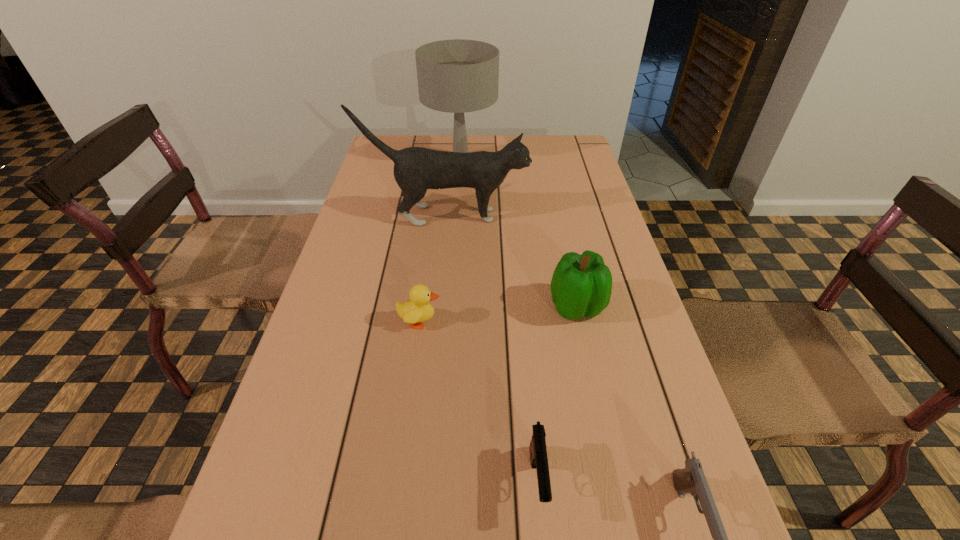
Locate an element on the screen. This screenshot has width=960, height=540. the farthest object is located at coordinates (457, 76).

Identify the location of the second farthest object. (416, 169).

The image size is (960, 540). In order to click on bell pepper in this screenshot , I will do `click(581, 285)`.

You are a GUI agent. You are given a task and a screenshot of the screen. Output one action in this format:
    pyautogui.click(x=<x>, y=<y>)
    Task: Click on the fourth shortest object
    The height and width of the screenshot is (540, 960).
    Given the screenshot: What is the action you would take?
    pyautogui.click(x=581, y=285)

The height and width of the screenshot is (540, 960). I want to click on duckling, so click(417, 309).

You are a GUI agent. You are given a task and a screenshot of the screen. Output one action in this format:
    pyautogui.click(x=<x>, y=<y>)
    Task: Click on the left pistol
    This screenshot has height=540, width=960.
    Given the screenshot: What is the action you would take?
    pyautogui.click(x=538, y=453)

Identify the location of free space located on the front-facing side of the farthest object. (537, 158).

Find the location of `vacant position located 0.230m at the face of the fifth nearest object`. vacant position located 0.230m at the face of the fifth nearest object is located at coordinates (607, 215).

Identify the location of vacant point located 0.260m on the left of the second object from right to left. (437, 307).

The width and height of the screenshot is (960, 540). I want to click on vacant region located 0.180m on the front-facing side of the duckling, so click(x=522, y=322).